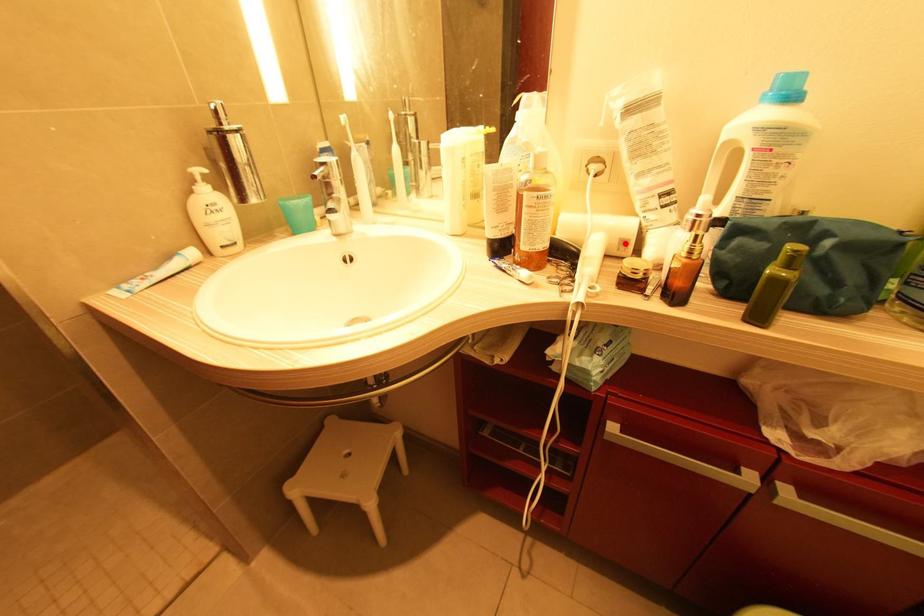
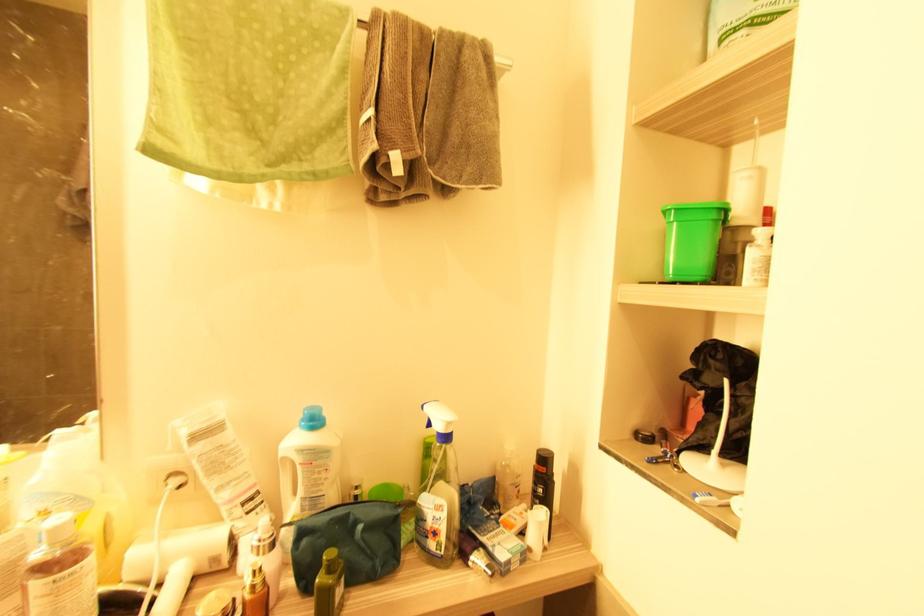
In the second image, find the point that corresponds to the highlighted location in the first image.

(216, 561)